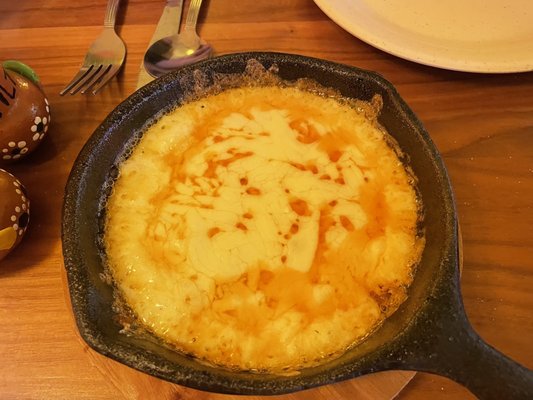
You are a GUI agent. You are given a task and a screenshot of the screen. Output one action in this format:
    pyautogui.click(x=<x>, y=<y>)
    Task: Click on the fork
    This screenshot has height=400, width=533.
    Given the screenshot: What is the action you would take?
    pyautogui.click(x=111, y=53)